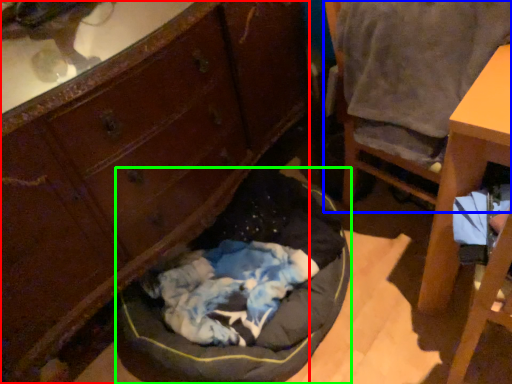
Question: Which object is positioned farthest from cabinetry (highlighted by a red box)? Select from chair (highlighted by a blue box) and dog bed (highlighted by a green box).

Choices:
 (A) chair
 (B) dog bed

Answer: (A)